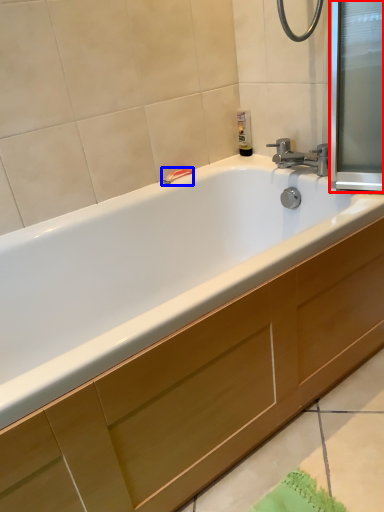
Question: Which object appears closest to the camera in this image, screen door (highlighted by a red box) or towel bar (highlighted by a blue box)?

Choices:
 (A) screen door
 (B) towel bar

Answer: (A)